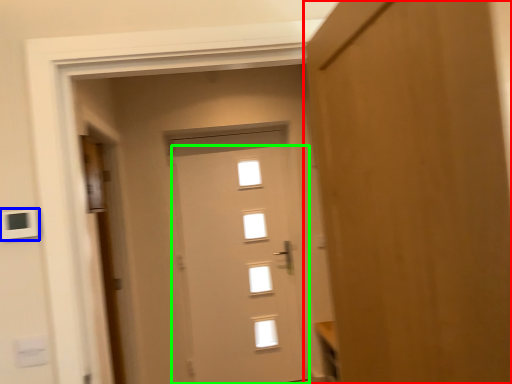
Question: Which object is positioned farthest from door (highlighted by a red box)? Select from light switch (highlighted by a blue box) and door (highlighted by a green box).

Choices:
 (A) light switch
 (B) door

Answer: (B)